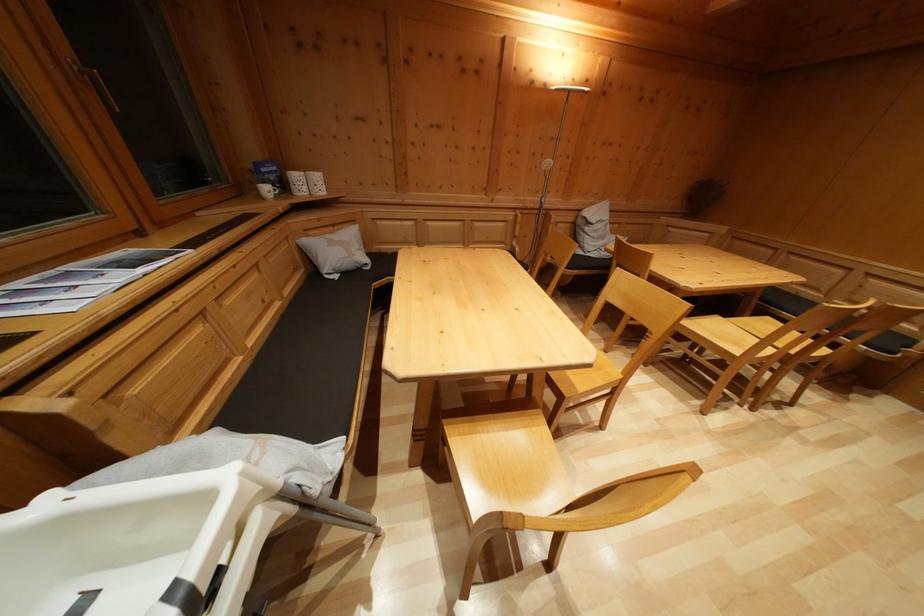
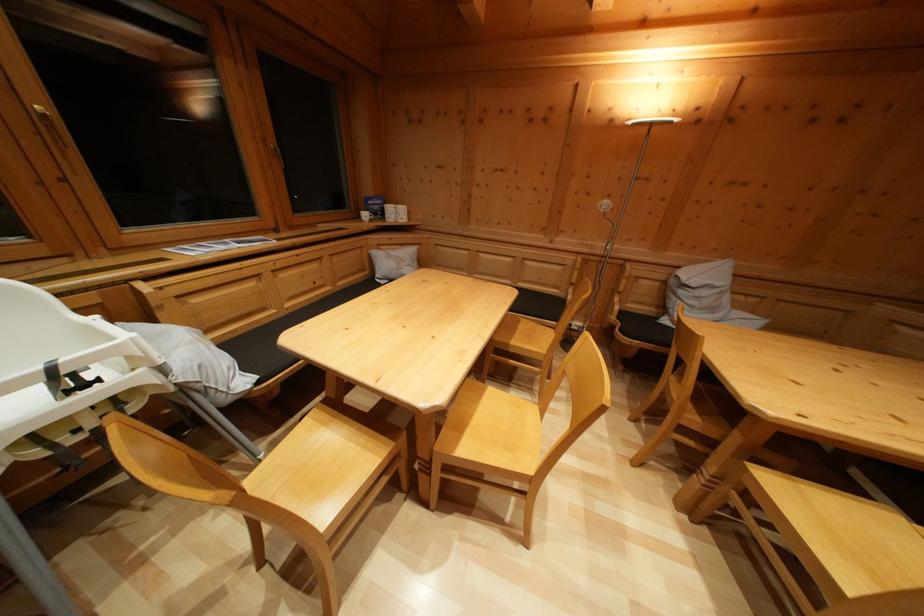
The point at [249,368] is marked in the first image. Where is the corresponding point in the second image?

(282, 321)